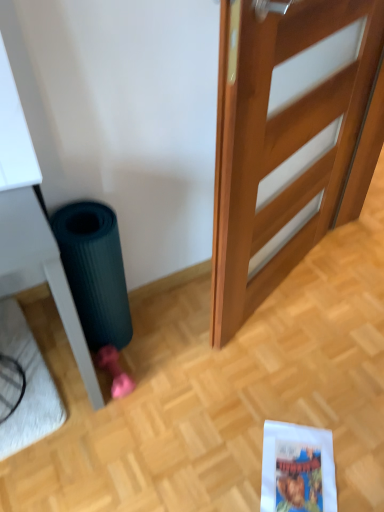
Locate an element on the screen. Image resolution: width=384 pixels, height=512 pixels. free space above blue glossy comic book at lower right (from a real-world perspective) is located at coordinates (302, 472).